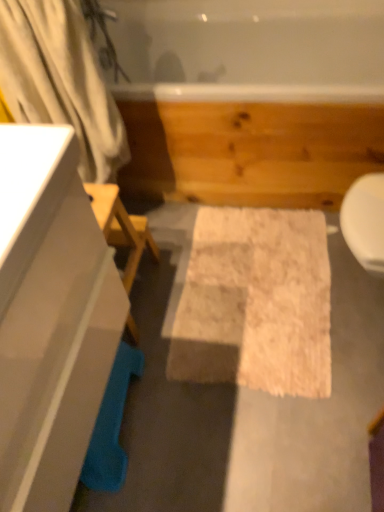
Question: Is white fabric shower curtain at left to the left or to the right of white glossy cabinet at left in the image?

Choices:
 (A) right
 (B) left

Answer: (A)

Question: From the image's perspective, is white fabric shower curtain at left positioned above or below white glossy cabinet at left?

Choices:
 (A) below
 (B) above

Answer: (B)

Question: Based on their relative distances, which object is farther from the white fabric shower curtain at left?

Choices:
 (A) white fluffy bath mat at center
 (B) white glossy cabinet at left
 (C) white glossy tub at upper center

Answer: (A)

Question: Which is farther from the white glossy cabinet at left?

Choices:
 (A) white fluffy bath mat at center
 (B) white glossy tub at upper center
 (C) white fabric shower curtain at left

Answer: (B)